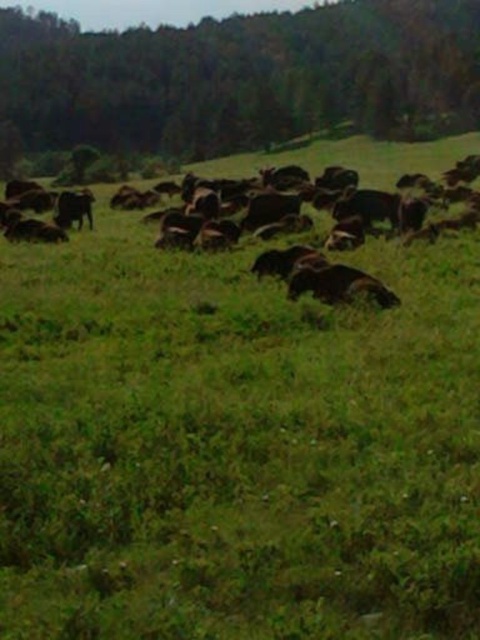
Question: Is green grassy hillside at upper center above brown furry cow at center?

Choices:
 (A) yes
 (B) no

Answer: (A)

Question: Which of the following is the closest to the observer?

Choices:
 (A) brown furry cow at center
 (B) green grassy hillside at upper center

Answer: (A)

Question: Which point is farther from the camera taking this photo?

Choices:
 (A) (35, 40)
 (B) (476, 252)

Answer: (A)

Question: Considering the relative positions of green grassy hillside at upper center and brown furry cow at center in the image provided, where is green grassy hillside at upper center located with respect to brown furry cow at center?

Choices:
 (A) above
 (B) below

Answer: (A)

Question: Can you confirm if green grassy hillside at upper center is positioned to the left of brown furry cow at center?

Choices:
 (A) no
 (B) yes

Answer: (B)